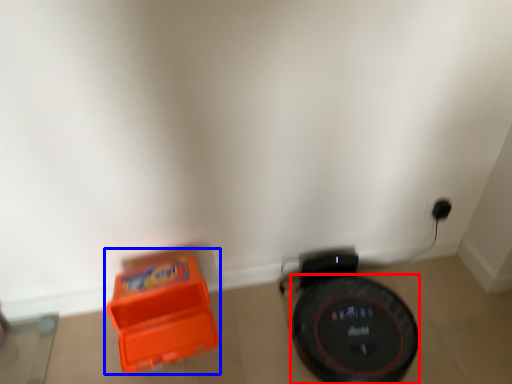
Question: Which object appears closest to the camera in this image, wheel (highlighted by a red box) or toy (highlighted by a blue box)?

Choices:
 (A) wheel
 (B) toy

Answer: (B)